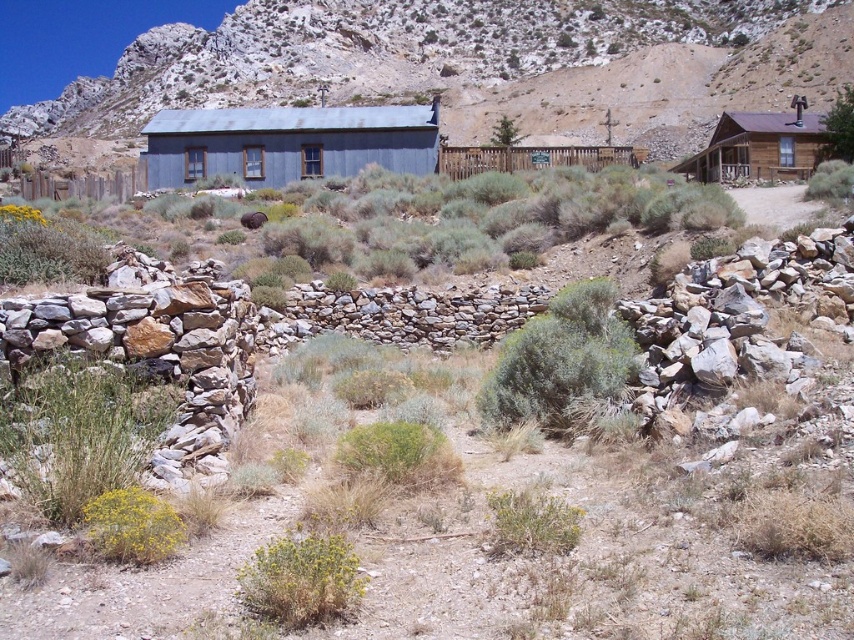
You are planning to build a garden path between the blue corrugated metal cabin at center and the green leafy bush at center. Which object should you place the path closer to if you want the path to be wider than the narrower of the two objects?

The blue corrugated metal cabin at center is wider than the green leafy bush at center. Therefore, placing the path closer to the green leafy bush at center ensures the path can be wider than the narrower object.